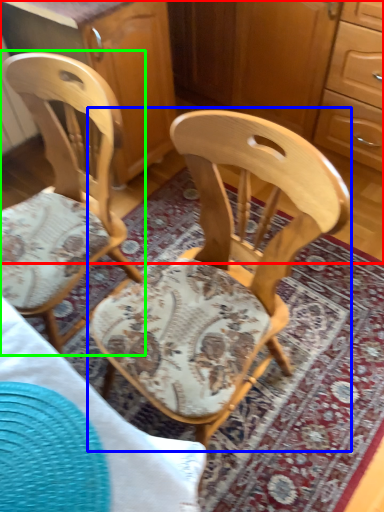
Question: Estimate the real-world distances between objects in this image. Which object is closer to dresser (highlighted by a red box), chair (highlighted by a blue box) or chair (highlighted by a green box)?

Choices:
 (A) chair
 (B) chair

Answer: (A)